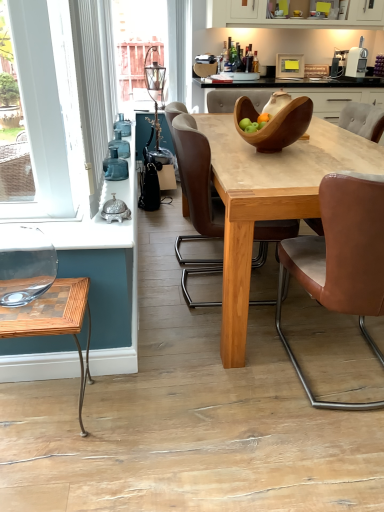
The image size is (384, 512). In order to click on free space in front of wooden bowl at center in this screenshot , I will do `click(281, 166)`.